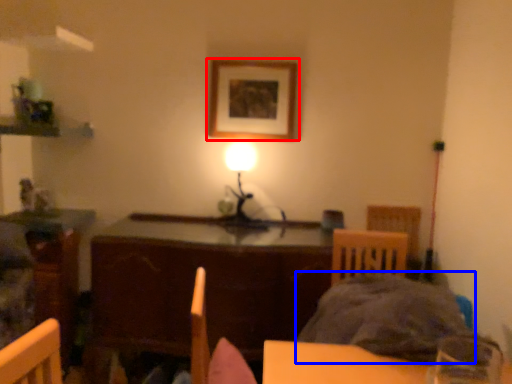
Question: Which object is further to the camera taking this photo, picture frame (highlighted by a red box) or bedding (highlighted by a blue box)?

Choices:
 (A) picture frame
 (B) bedding

Answer: (A)